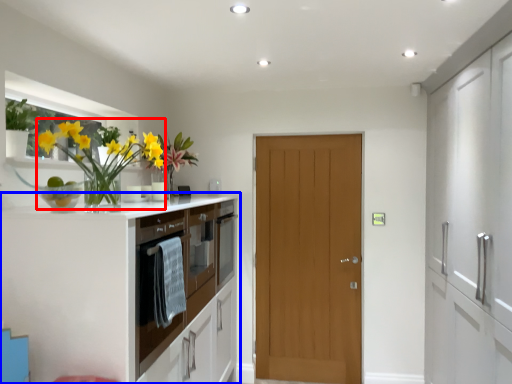
Question: Which of the following is the closest to the observer, floral arrangement (highlighted by a red box) or cabinetry (highlighted by a blue box)?

Choices:
 (A) floral arrangement
 (B) cabinetry

Answer: (A)